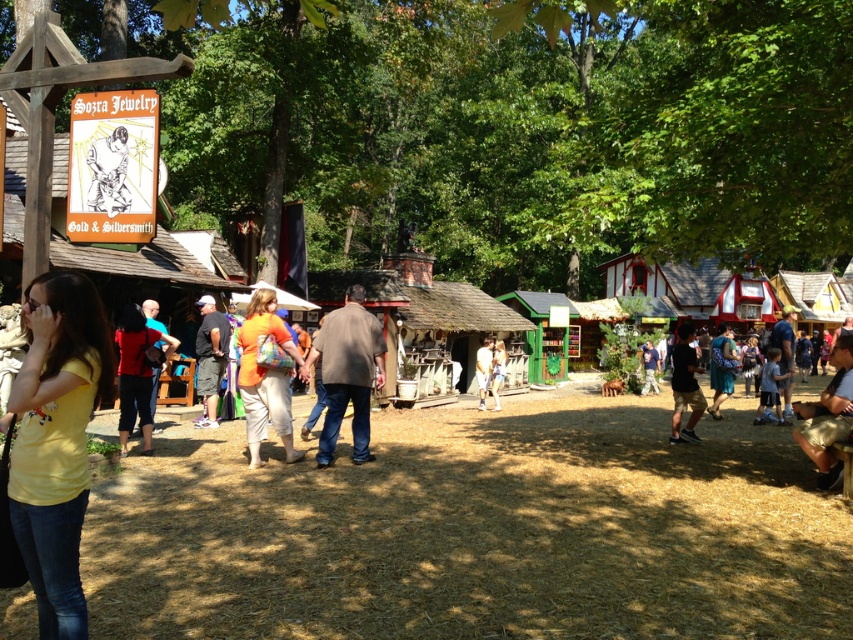
Question: Does yellow matte t-shirt at lower left come behind orange fabric purse at center?

Choices:
 (A) no
 (B) yes

Answer: (A)

Question: Which of the following is the closest to the observer?

Choices:
 (A) (50, 634)
 (B) (254, 442)

Answer: (A)

Question: Can you confirm if yellow matte t-shirt at lower left is positioned to the right of orange fabric purse at center?

Choices:
 (A) no
 (B) yes

Answer: (B)

Question: Is yellow matte t-shirt at lower left in front of orange fabric purse at center?

Choices:
 (A) no
 (B) yes

Answer: (B)